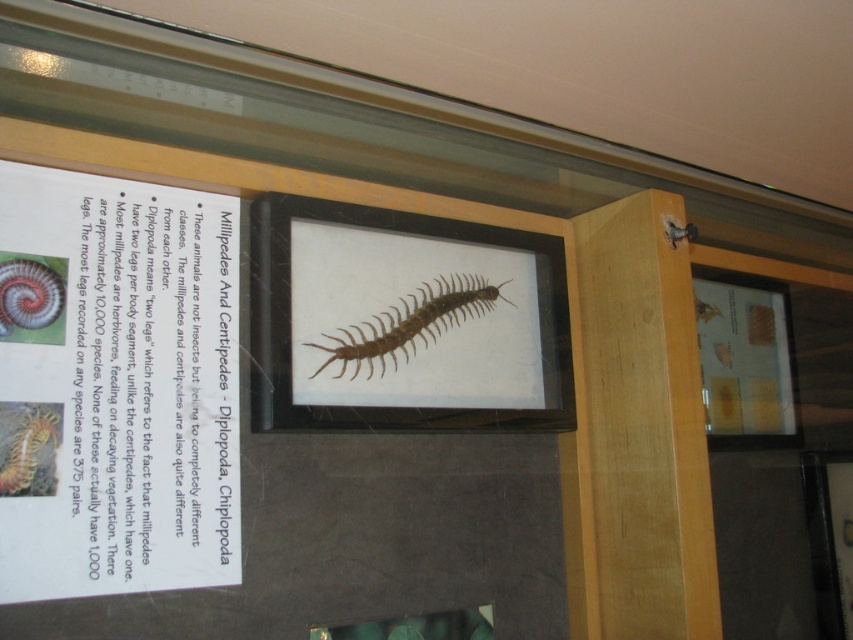
Does brown matte centipede at center appear on the left side of bright orange centipede at lower left?

In fact, brown matte centipede at center is to the right of bright orange centipede at lower left.

Who is higher up, brown matte centipede at center or bright orange centipede at lower left?

brown matte centipede at center is above.

Which is in front, point (380, 355) or point (35, 436)?

Point (35, 436)

The height and width of the screenshot is (640, 853). Find the location of `brown matte centipede at center`. brown matte centipede at center is located at coordinates (410, 323).

Does white paper at upper left have a greater height compared to bright orange centipede at lower left?

Indeed, white paper at upper left has a greater height compared to bright orange centipede at lower left.

Does white paper at upper left lie in front of bright orange centipede at lower left?

That is True.

Is point (193, 339) closer to viewer compared to point (22, 442)?

No, (193, 339) is behind (22, 442).

Where is `white paper at upper left`? white paper at upper left is located at coordinates (119, 388).

Can you confirm if white paper at upper left is positioned below shiny metallic spiral at left?

Indeed, white paper at upper left is positioned under shiny metallic spiral at left.

Does white paper at upper left have a greater height compared to shiny metallic spiral at left?

Yes, white paper at upper left is taller than shiny metallic spiral at left.

Identify the location of white paper at upper left. The width and height of the screenshot is (853, 640). (119, 388).

At what (x,y) coordinates should I click in order to perform the action: click on white paper at upper left. Please return your answer as a coordinate pair (x, y). This screenshot has width=853, height=640. Looking at the image, I should click on (119, 388).